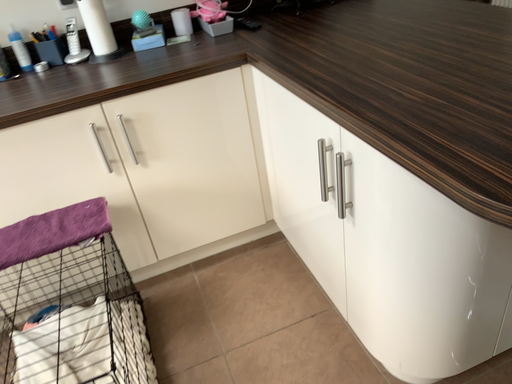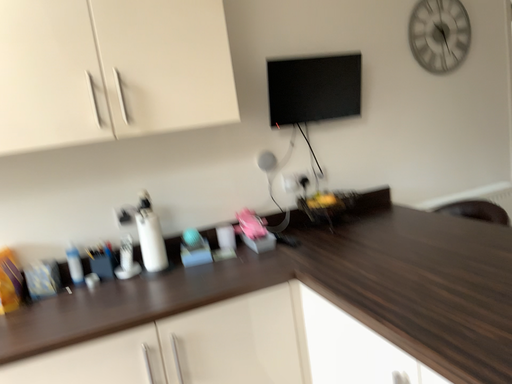
Question: How did the camera likely rotate when shooting the video?

Choices:
 (A) rotated downward
 (B) rotated upward

Answer: (B)